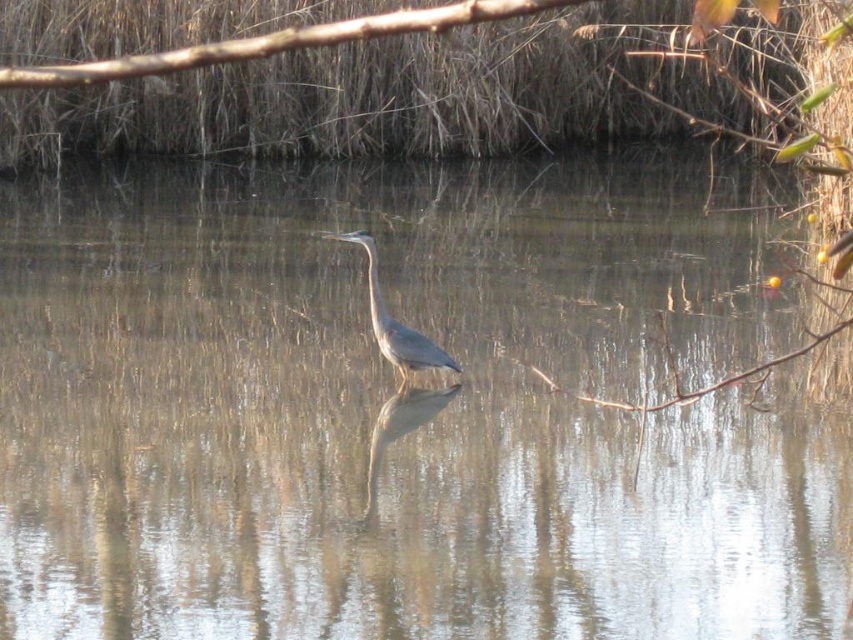
Between brown rough branch at upper center and gray matte bird at center, which one appears on the left side from the viewer's perspective?

brown rough branch at upper center is more to the left.

Does brown rough branch at upper center appear over gray matte bird at center?

Yes, brown rough branch at upper center is above gray matte bird at center.

Which is behind, point (212, 49) or point (415, 336)?

The point (415, 336) is more distant.

Find the location of `brown rough branch at upper center`. brown rough branch at upper center is located at coordinates (276, 42).

Looking at this image, is gray matte bird at center above blue glossy heron at center?

Yes.

Identify the location of gray matte bird at center. (393, 323).

Locate an element on the screen. gray matte bird at center is located at coordinates (393, 323).

Locate an element on the screen. This screenshot has width=853, height=640. gray matte bird at center is located at coordinates (393, 323).

Which is behind, point (424, 8) or point (395, 396)?

Positioned behind is point (424, 8).

Is brown rough branch at upper center closer to the viewer compared to blue glossy heron at center?

Yes, brown rough branch at upper center is closer to the viewer.

Find the location of a particular element. The width and height of the screenshot is (853, 640). brown rough branch at upper center is located at coordinates (276, 42).

You are a GUI agent. You are given a task and a screenshot of the screen. Output one action in this format:
    pyautogui.click(x=<x>, y=<y>)
    Task: Click on the brown rough branch at upper center
    This screenshot has width=853, height=640.
    Given the screenshot: What is the action you would take?
    pyautogui.click(x=276, y=42)